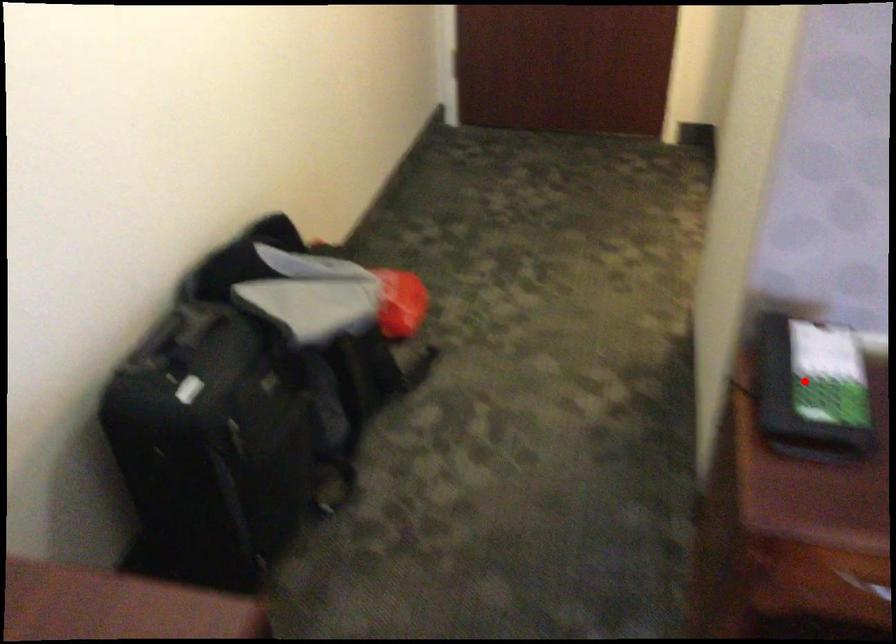
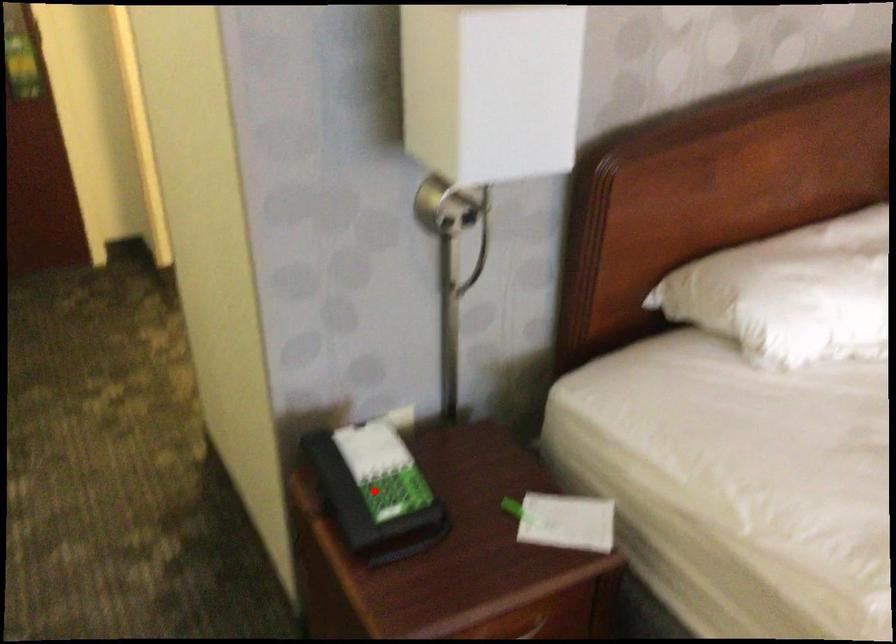
Looking at this image, I am providing you with two images of the same scene from different viewpoints. A red point is marked on the first image and another point is marked on the second image. Are the points marked in image1 and image2 representing the same 3D position?

Yes